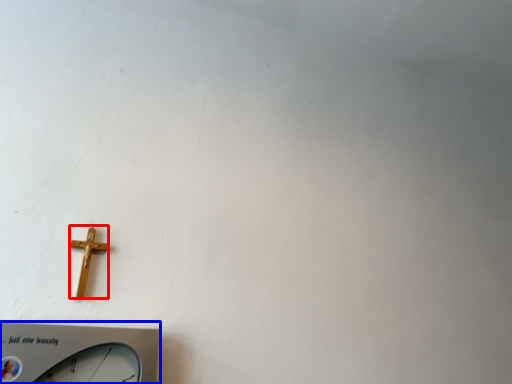
Question: Which of the following is the farthest to the observer, crucifix (highlighted by a red box) or wall clock (highlighted by a blue box)?

Choices:
 (A) crucifix
 (B) wall clock

Answer: (A)